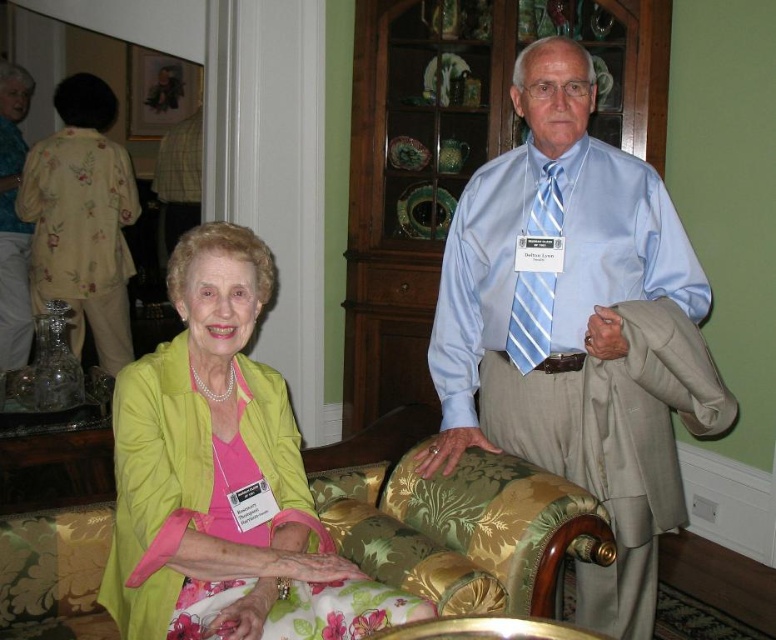
From the picture: You are standing in the room and want to determine which of the two points, point (203, 483) or point (532, 276), is nearer to you. Based on the scene description, which point is closer?

Point (203, 483) is closer to the viewer than point (532, 276).

Based on the photo, you are a photographer trying to focus on the light blue satin shirt at upper center. The camera has a focus point at coordinates point (577, 328). Is the focus point correctly placed to capture the light blue satin shirt at upper center?

Yes, the focus point at point (577, 328) is correctly placed because the Objects Description states that this point corresponds to the light blue satin shirt at upper center.